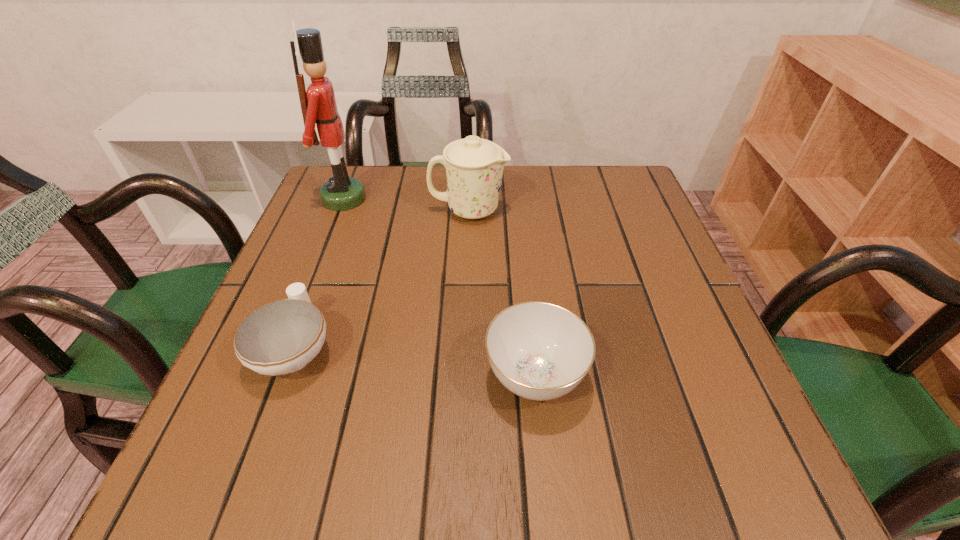
Where is `vacant area situated 0.400m on the side with the handle of the leftmost chinaware`? This screenshot has height=540, width=960. vacant area situated 0.400m on the side with the handle of the leftmost chinaware is located at coordinates (353, 192).

Identify the location of free spot located on the side with the handle of the leftmost chinaware. (349, 204).

Where is `nutcracker present at the far edge`? nutcracker present at the far edge is located at coordinates (318, 105).

I want to click on chinaware at the far edge, so click(474, 166).

In order to click on nutcracker at the left edge in this screenshot , I will do `click(318, 105)`.

Locate an element on the screen. The image size is (960, 540). chinaware located in the left edge section of the desktop is located at coordinates (281, 337).

Find the location of `object situated at the far left corner`. object situated at the far left corner is located at coordinates (318, 105).

Locate an element on the screen. vacant space at the far edge of the desktop is located at coordinates (396, 178).

At what (x,y) coordinates should I click in order to perform the action: click on vacant space at the near edge. Please return your answer as a coordinate pair (x, y). Looking at the image, I should click on (418, 475).

In the image, there is a desktop. Find the location of `vacant space at the right edge`. vacant space at the right edge is located at coordinates [628, 253].